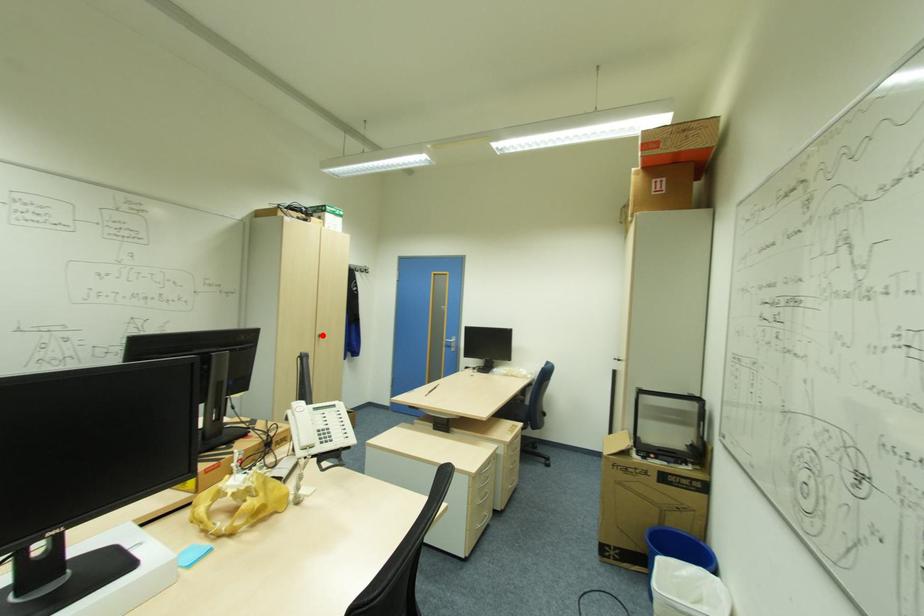
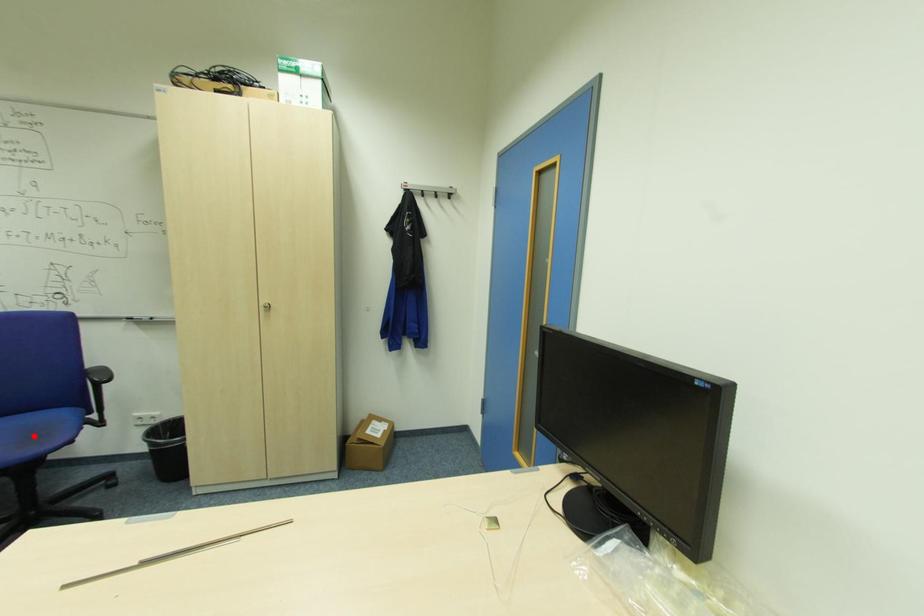
I am providing you with two images of the same scene from different viewpoints. A red point is marked on the first image and another point is marked on the second image. Do the highlighted points in image1 and image2 indicate the same real-world spot?

No